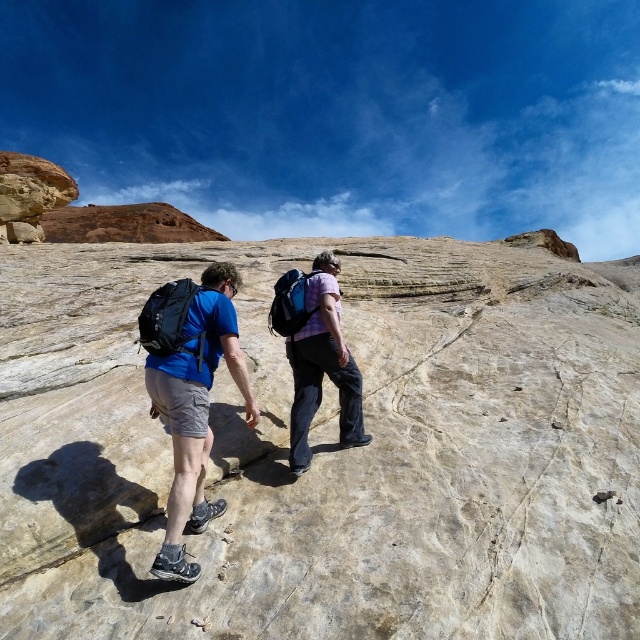
You are a photographer positioned at the edge of the rock formation. You want to take a photo that includes both the matte blue shirt at center and the plaid shirt at center. Which shirt should you adjust your focus on to ensure the foreground subject is in sharp focus?

The matte blue shirt at center is closer to the viewer than the plaid shirt at center, so you should focus on the matte blue shirt at center to ensure the foreground subject is in sharp focus.

You are a photographer trying to capture both the matte blue shirt at center and the matte black backpack at center in a single frame. Which object should you focus on first to ensure both are in focus, considering their sizes?

The matte blue shirt at center is thinner than the matte black backpack at center, so you should focus on the matte black backpack at center first since larger objects require more precise focusing to ensure sharpness throughout.

Two hikers are walking on a flat desert landscape. The first hiker is wearing a blue t shirt and gray shorts, and the second hiker is wearing a pink and white checkered shirt and dark pants. They are standing at coordinates point (189, 403). How far apart are they?

The two hikers are 61.67 feet apart.